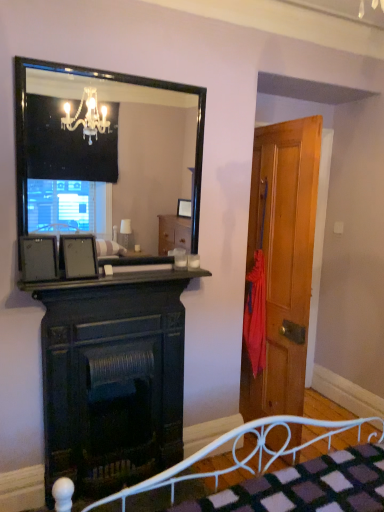
Question: Is the depth of matte black picture frame at left, arranged as the 2th picture frame when viewed from the right, greater than that of dark wood fireplace at center?

Choices:
 (A) yes
 (B) no

Answer: (B)

Question: From the image's perspective, is matte black picture frame at left, the 1th picture frame viewed from the left, located beneath dark wood fireplace at center?

Choices:
 (A) no
 (B) yes

Answer: (A)

Question: From a real-world perspective, does matte black picture frame at left, the 1th picture frame viewed from the left, sit lower than dark wood fireplace at center?

Choices:
 (A) no
 (B) yes

Answer: (A)

Question: Can you confirm if matte black picture frame at left, arranged as the 2th picture frame when viewed from the right, is thinner than dark wood fireplace at center?

Choices:
 (A) yes
 (B) no

Answer: (A)

Question: Considering the relative sizes of matte black picture frame at left, arranged as the 2th picture frame when viewed from the right, and dark wood fireplace at center in the image provided, is matte black picture frame at left, arranged as the 2th picture frame when viewed from the right, taller than dark wood fireplace at center?

Choices:
 (A) no
 (B) yes

Answer: (A)

Question: Is black glossy mirror at upper center to the left or to the right of matte black picture frame at left, arranged as the 2th picture frame when viewed from the right, in the image?

Choices:
 (A) left
 (B) right

Answer: (B)

Question: Is black glossy mirror at upper center in front of or behind matte black picture frame at left, arranged as the 2th picture frame when viewed from the right, in the image?

Choices:
 (A) behind
 (B) front

Answer: (B)

Question: Is point (177, 164) positioned closer to the camera than point (43, 279)?

Choices:
 (A) farther
 (B) closer

Answer: (A)

Question: Based on their sizes in the image, would you say black glossy mirror at upper center is bigger or smaller than matte black picture frame at left, arranged as the 2th picture frame when viewed from the right?

Choices:
 (A) big
 (B) small

Answer: (A)

Question: Is point (228, 433) closer or farther from the camera than point (51, 242)?

Choices:
 (A) closer
 (B) farther

Answer: (B)

Question: Considering the relative positions of white metal bed frame at lower center and matte black picture frame at left, the 1th picture frame viewed from the left, in the image provided, is white metal bed frame at lower center to the left or to the right of matte black picture frame at left, the 1th picture frame viewed from the left,?

Choices:
 (A) right
 (B) left

Answer: (A)

Question: In the image, is white metal bed frame at lower center positioned in front of or behind matte black picture frame at left, arranged as the 2th picture frame when viewed from the right?

Choices:
 (A) front
 (B) behind

Answer: (A)

Question: From the image's perspective, is white metal bed frame at lower center located above or below matte black picture frame at left, the 1th picture frame viewed from the left?

Choices:
 (A) below
 (B) above

Answer: (A)

Question: From the image's perspective, is wooden door at right located above or below dark wood fireplace at center?

Choices:
 (A) above
 (B) below

Answer: (A)

Question: Is wooden door at right in front of or behind dark wood fireplace at center in the image?

Choices:
 (A) behind
 (B) front

Answer: (A)